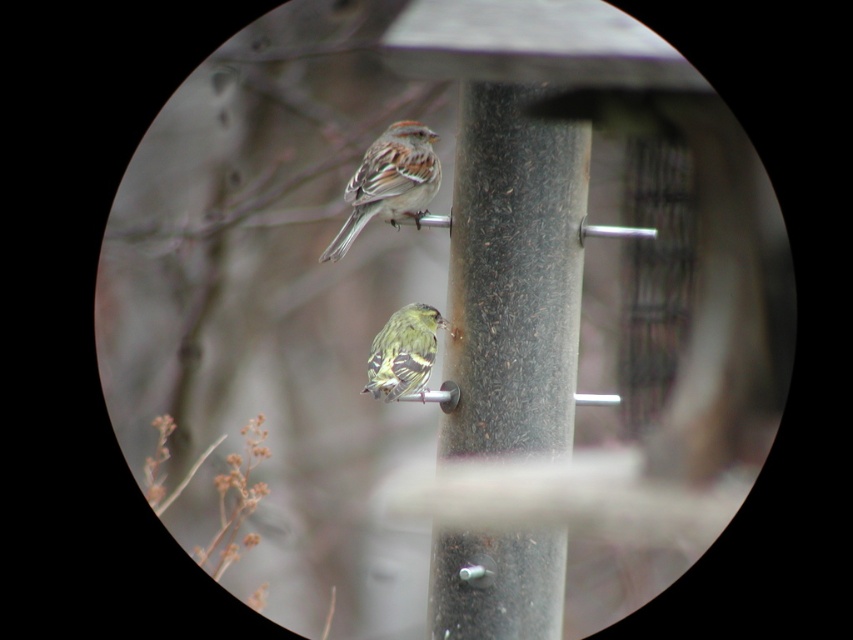
You are using a telescope to look at the birds on the pole. The telescope has a crosshair that can be placed at any coordinate. You want to center the crosshair on the brown speckled feathers at upper center. What coordinates should you set the crosshair to?

The brown speckled feathers at upper center are located at coordinates point (x=389, y=182), so you should set the crosshair to those coordinates to center it on them.